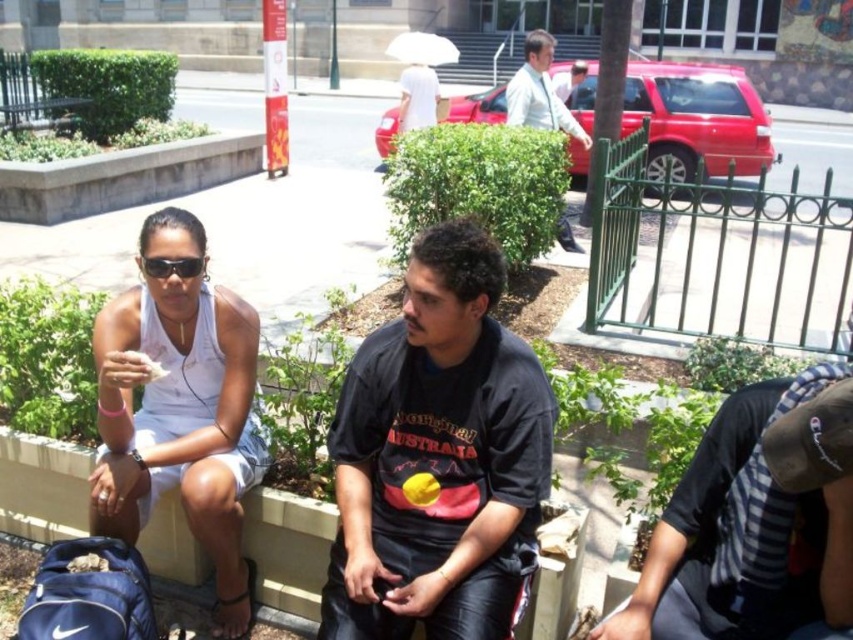
You are a photographer trying to capture a photo of the wooden park bench at center without the white fabric tank top at left blocking the view. Based on their heights, is it possible to take the photo from a lower angle so the bench is fully visible?

The white fabric tank top at left is taller than wooden park bench at center, so taking the photo from a lower angle might still result in the tank top blocking the bench since it is taller. Consider moving to a different position where the bench is not obscured.

You are standing at the wooden park bench at center and want to hand a book to the person wearing the striped shirt at lower right. Considering the distance between you and them, do you think you can throw the book directly without needing to walk closer?

The striped shirt at lower right is 9.64 meters away from the wooden park bench at center. Throwing a book accurately over this distance might be challenging, but it is possible depending on your throwing ability. However, walking closer would ensure the book reaches them safely.

You are standing at the point marked by the coordinates point (438, 456) in the image. Which object from the scene are you currently standing on?

The point (438, 456) is on the black matte shirt at center.